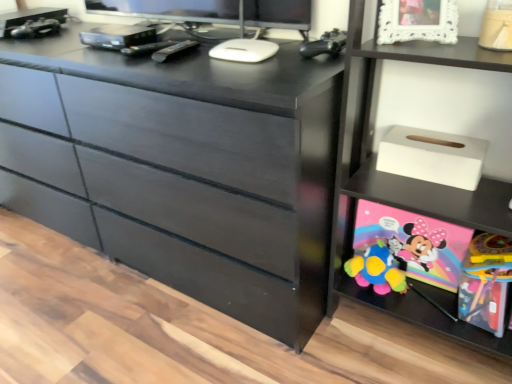
Locate an element on the screen. This screenshot has width=512, height=384. blank space situated above white matte tissue box at upper right (from a real-world perspective) is located at coordinates (435, 138).